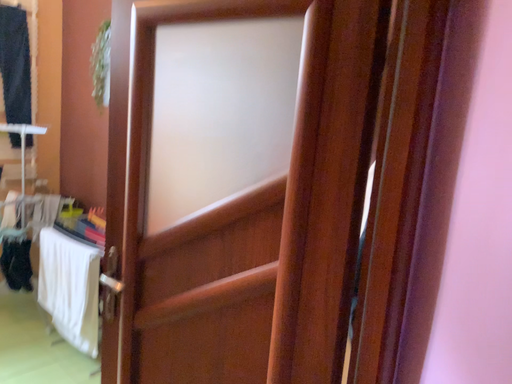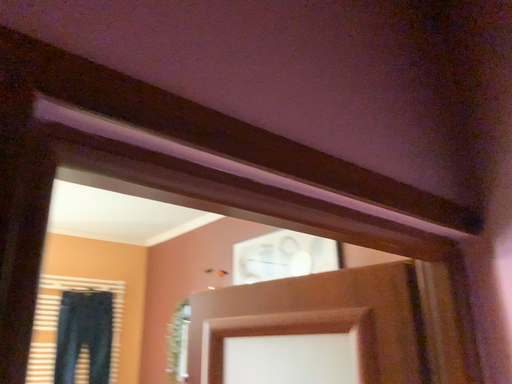
Question: Which way did the camera rotate in the video?

Choices:
 (A) rotated upward
 (B) rotated downward

Answer: (A)